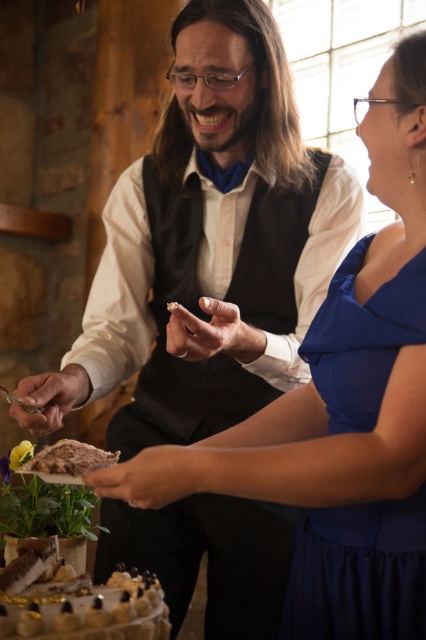
Question: Is chocolate frosted cake at lower left further to camera compared to brown crumbly cake at lower left?

Choices:
 (A) no
 (B) yes

Answer: (A)

Question: Which point is farther to the camera?

Choices:
 (A) chocolate frosted cake at lower left
 (B) brown crumbly cake at lower left

Answer: (B)

Question: Does chocolate frosted cake at lower left have a smaller size compared to brown crumbly cake at lower left?

Choices:
 (A) no
 (B) yes

Answer: (A)

Question: Which of the following is the farthest from the observer?

Choices:
 (A) brown crumbly cake at lower left
 (B) chocolate frosted cake at lower left

Answer: (A)

Question: Does chocolate frosted cake at lower left lie in front of brown crumbly cake at lower left?

Choices:
 (A) no
 (B) yes

Answer: (B)